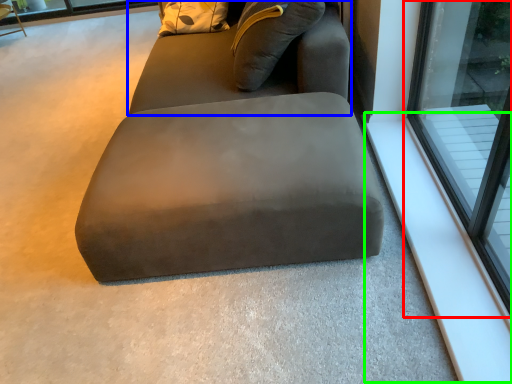
Question: Estimate the real-world distances between objects in this image. Which object is closer to window (highlighted by a red box), bean bag chair (highlighted by a blue box) or window sill (highlighted by a green box)?

Choices:
 (A) bean bag chair
 (B) window sill

Answer: (B)